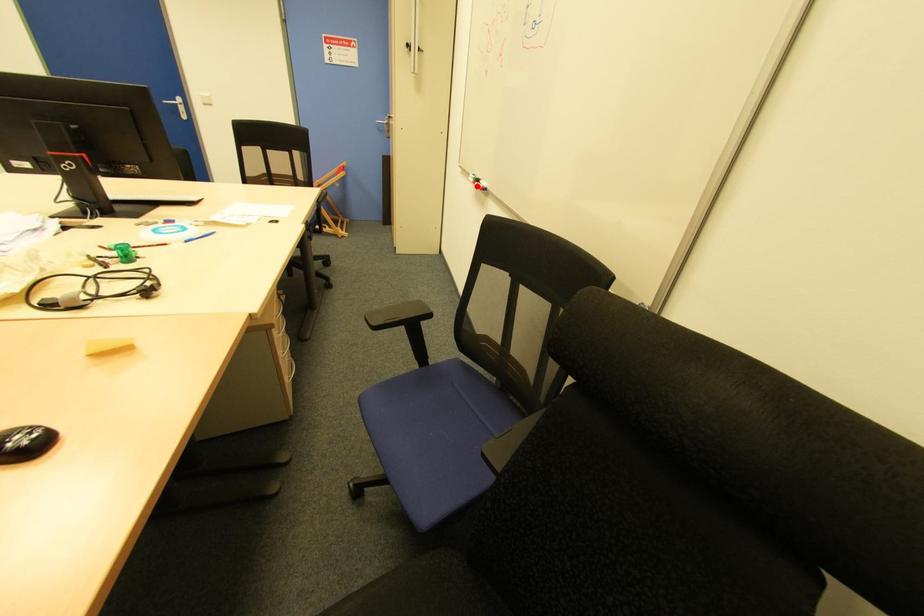
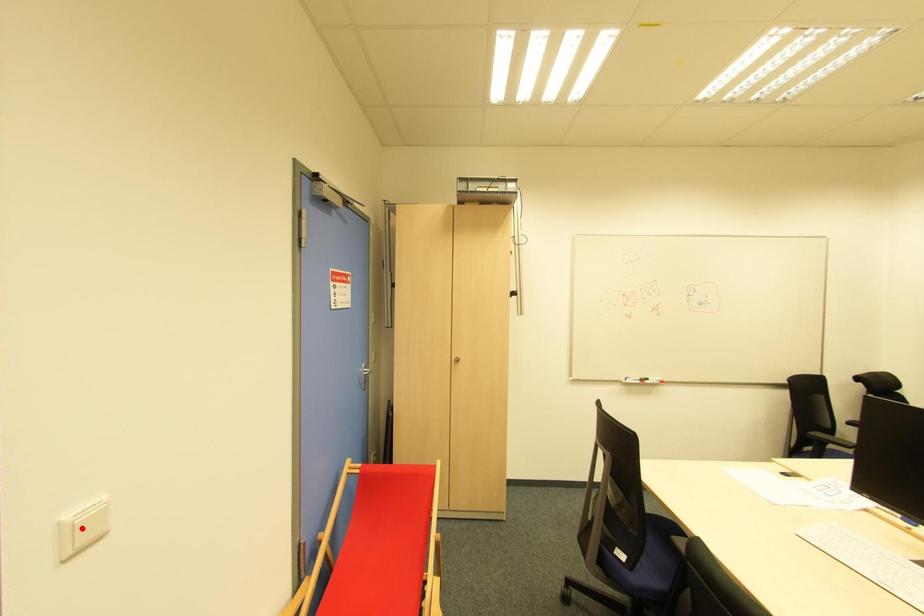
I am providing you with two images of the same scene from different viewpoints. A red point is marked on the first image and another point is marked on the second image. Is the red point in image1 aligned with the point shown in image2?

No